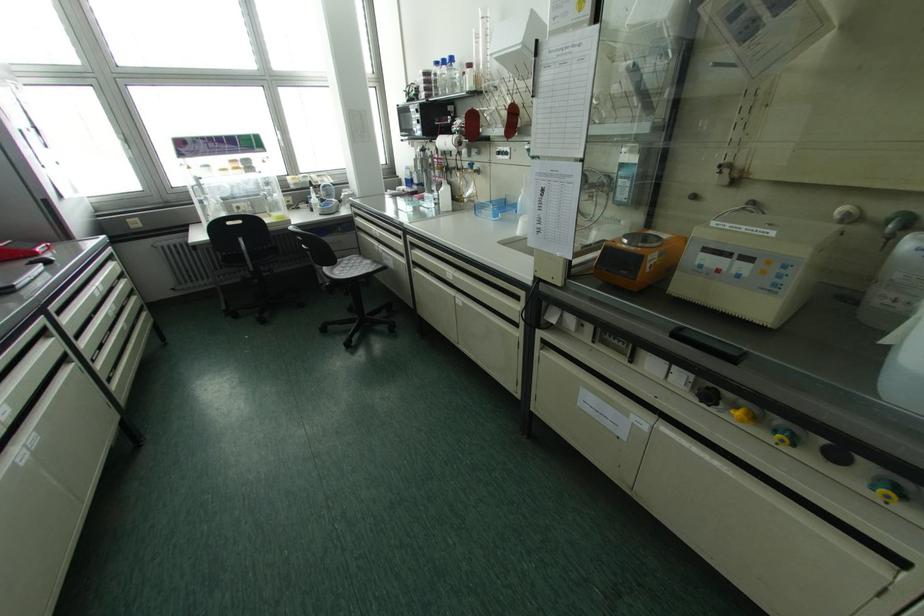
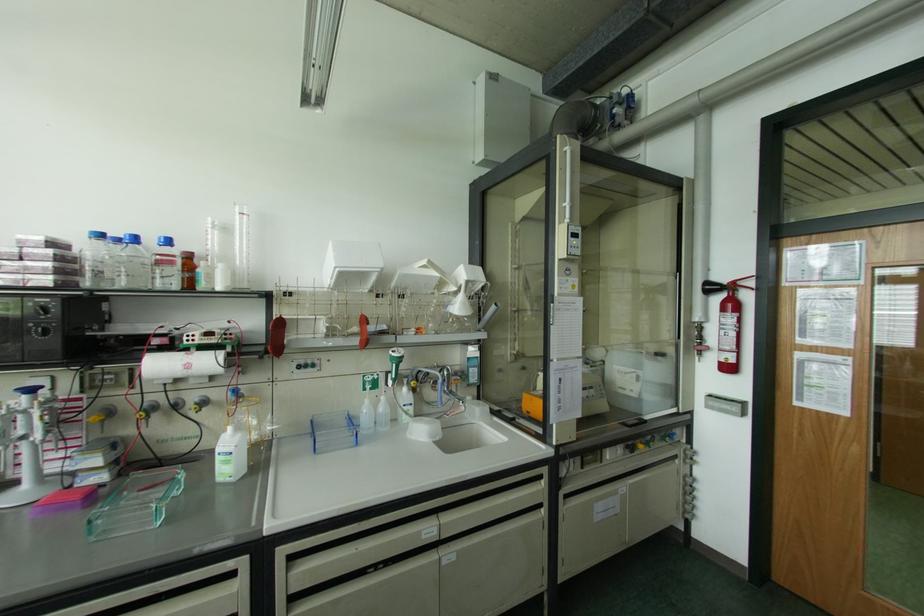
In the second image, find the point that corresponds to pixel 468 66 in the first image.

(188, 256)